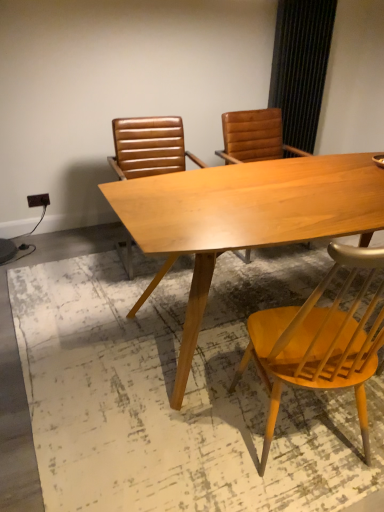
Question: Considering the positions of light wood chair at lower right, marked as the second chair in a back-to-front arrangement, and leather-like brown chair at center, which ranks as the first chair in back-to-front order, in the image, is light wood chair at lower right, marked as the second chair in a back-to-front arrangement, wider or thinner than leather-like brown chair at center, which ranks as the first chair in back-to-front order,?

Choices:
 (A) thin
 (B) wide

Answer: (A)

Question: Relative to leather-like brown chair at center, the 1th chair from the left, is light wood chair at lower right, which appears as the second chair when viewed from the left, in front or behind?

Choices:
 (A) behind
 (B) front

Answer: (B)

Question: Considering the real-world distances, which object is closest to the light wood chair at lower right, which appears as the second chair when viewed from the left?

Choices:
 (A) light wood table at center
 (B) leather-like brown chair at center, the 1th chair from the left

Answer: (A)

Question: Which is nearer to the light wood table at center?

Choices:
 (A) light wood chair at lower right, marked as the second chair in a back-to-front arrangement
 (B) leather-like brown chair at center, which ranks as the first chair in back-to-front order

Answer: (A)